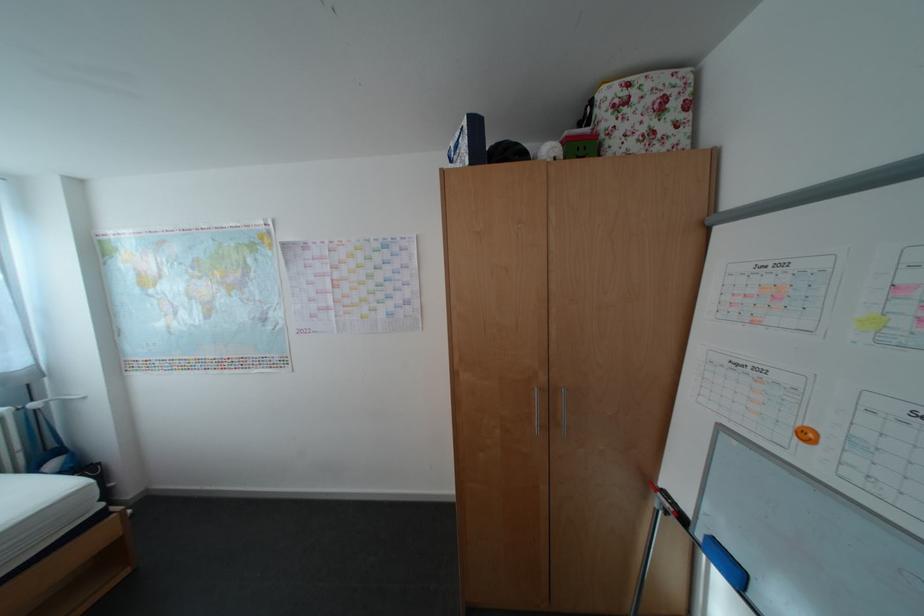
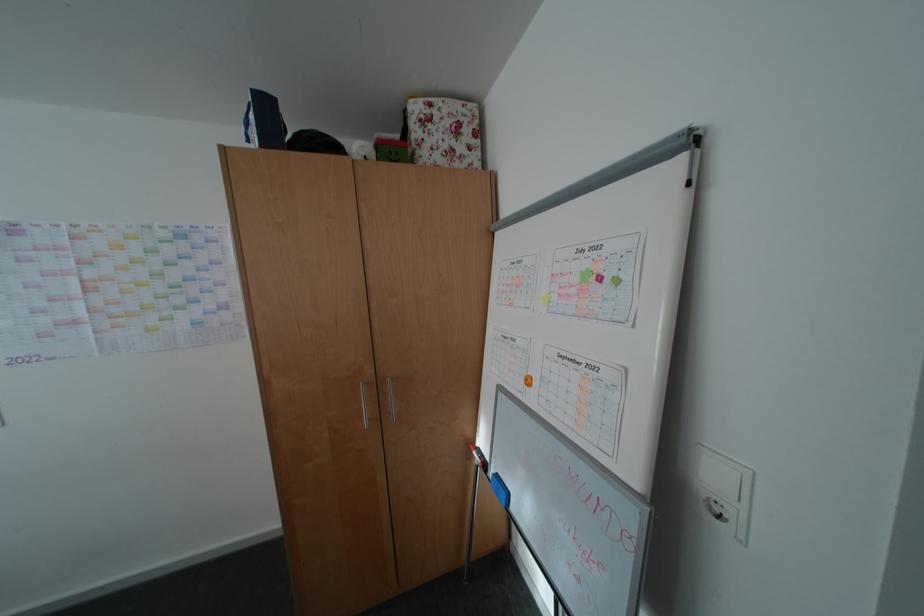
In the second image, find the point that corresponds to point (562, 392) in the first image.

(390, 385)